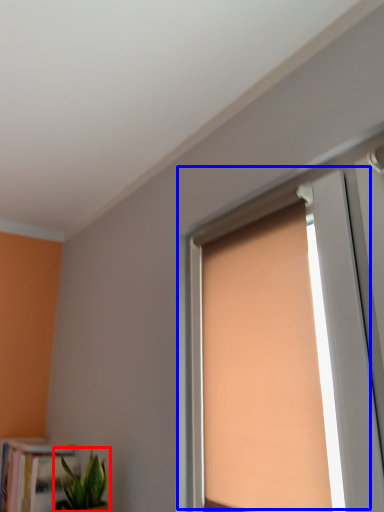
Question: Which point is further to the camera, houseplant (highlighted by a red box) or window (highlighted by a blue box)?

Choices:
 (A) houseplant
 (B) window

Answer: (A)